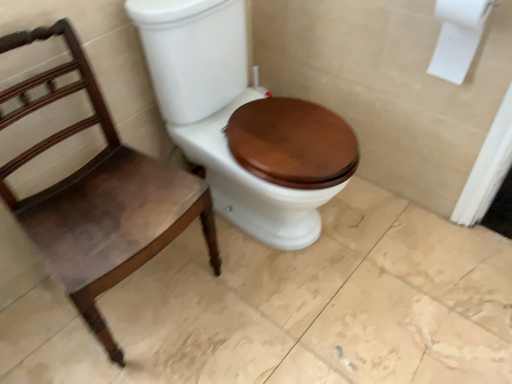
This screenshot has width=512, height=384. In order to click on mahogany wood chair at left in this screenshot , I will do `click(99, 194)`.

You are a GUI agent. You are given a task and a screenshot of the screen. Output one action in this format:
    pyautogui.click(x=<x>, y=<y>)
    Task: Click on the matte brown wood toilet seat at center
    This screenshot has width=512, height=384.
    Given the screenshot: What is the action you would take?
    pyautogui.click(x=242, y=122)

Is white paper at upper right outside of matte brown wood toilet seat at center?

white paper at upper right lies outside matte brown wood toilet seat at center's area.

Is white paper at upper right far away from matte brown wood toilet seat at center?

white paper at upper right is near matte brown wood toilet seat at center, not far away.

Does white paper at upper right have a larger size compared to matte brown wood toilet seat at center?

No.

Considering the positions of objects white paper at upper right and matte brown wood toilet seat at center in the image provided, who is behind, white paper at upper right or matte brown wood toilet seat at center?

white paper at upper right is behind.

Is the position of matte brown wood toilet seat at center less distant than that of white paper at upper right?

Yes, it is.

Does matte brown wood toilet seat at center have a greater width compared to white paper at upper right?

Yes.

Are matte brown wood toilet seat at center and white paper at upper right far apart?

No, matte brown wood toilet seat at center is not far from white paper at upper right.

Looking at this image, who is bigger, matte brown wood toilet seat at center or mahogany wood chair at left?

matte brown wood toilet seat at center.

Considering the relative positions of matte brown wood toilet seat at center and mahogany wood chair at left in the image provided, is matte brown wood toilet seat at center to the left of mahogany wood chair at left from the viewer's perspective?

In fact, matte brown wood toilet seat at center is to the right of mahogany wood chair at left.

Which is correct: matte brown wood toilet seat at center is inside mahogany wood chair at left, or outside of it?

matte brown wood toilet seat at center is spatially situated outside mahogany wood chair at left.

Is matte brown wood toilet seat at center far away from mahogany wood chair at left?

They are positioned close to each other.

Considering the relative sizes of mahogany wood chair at left and matte brown wood toilet seat at center in the image provided, is mahogany wood chair at left thinner than matte brown wood toilet seat at center?

Correct, the width of mahogany wood chair at left is less than that of matte brown wood toilet seat at center.

Locate an element on the screen. The height and width of the screenshot is (384, 512). toilet lying on the right of mahogany wood chair at left is located at coordinates (242, 122).

Is mahogany wood chair at left positioned far away from matte brown wood toilet seat at center?

mahogany wood chair at left is near matte brown wood toilet seat at center, not far away.

From the image's perspective, does mahogany wood chair at left appear lower than matte brown wood toilet seat at center?

Yes, from the image's perspective, mahogany wood chair at left is below matte brown wood toilet seat at center.

At what (x,y) coordinates should I click in order to perform the action: click on chair in front of the white paper at upper right. Please return your answer as a coordinate pair (x, y). The height and width of the screenshot is (384, 512). Looking at the image, I should click on (99, 194).

From the image's perspective, who appears lower, white paper at upper right or mahogany wood chair at left?

From the image's view, mahogany wood chair at left is below.

Is white paper at upper right next to mahogany wood chair at left?

No, white paper at upper right is not making contact with mahogany wood chair at left.

Is white paper at upper right facing towards mahogany wood chair at left?

No, white paper at upper right does not turn towards mahogany wood chair at left.

From a real-world perspective, is mahogany wood chair at left physically below white paper at upper right?

Yes, from a real-world perspective, mahogany wood chair at left is below white paper at upper right.

From the image's perspective, is mahogany wood chair at left under white paper at upper right?

Correct, mahogany wood chair at left appears lower than white paper at upper right in the image.

Considering the points (46, 218) and (461, 6), which point is in front, point (46, 218) or point (461, 6)?

Point (461, 6)

Which object is positioned more to the left, mahogany wood chair at left or white paper at upper right?

Positioned to the left is mahogany wood chair at left.

Where is `toilet on the left of white paper at upper right`? Image resolution: width=512 pixels, height=384 pixels. toilet on the left of white paper at upper right is located at coordinates (242, 122).

The image size is (512, 384). Find the location of `toilet paper that appears on the right of matte brown wood toilet seat at center`. toilet paper that appears on the right of matte brown wood toilet seat at center is located at coordinates 458,37.

Considering their positions, is mahogany wood chair at left positioned further to white paper at upper right than matte brown wood toilet seat at center?

mahogany wood chair at left is further to white paper at upper right.

From the image, which object appears to be nearer to white paper at upper right, matte brown wood toilet seat at center or mahogany wood chair at left?

matte brown wood toilet seat at center is positioned closer to the anchor white paper at upper right.

From the picture: Which object lies further to the anchor point matte brown wood toilet seat at center, mahogany wood chair at left or white paper at upper right?

white paper at upper right.

From the image, which object appears to be farther from mahogany wood chair at left, white paper at upper right or matte brown wood toilet seat at center?

white paper at upper right is positioned further to the anchor mahogany wood chair at left.

Based on their spatial positions, is matte brown wood toilet seat at center or white paper at upper right closer to mahogany wood chair at left?

matte brown wood toilet seat at center is closer to mahogany wood chair at left.

Which object lies nearer to the anchor point matte brown wood toilet seat at center, white paper at upper right or mahogany wood chair at left?

mahogany wood chair at left lies closer to matte brown wood toilet seat at center than the other object.

Identify the location of toilet between mahogany wood chair at left and white paper at upper right. (242, 122).